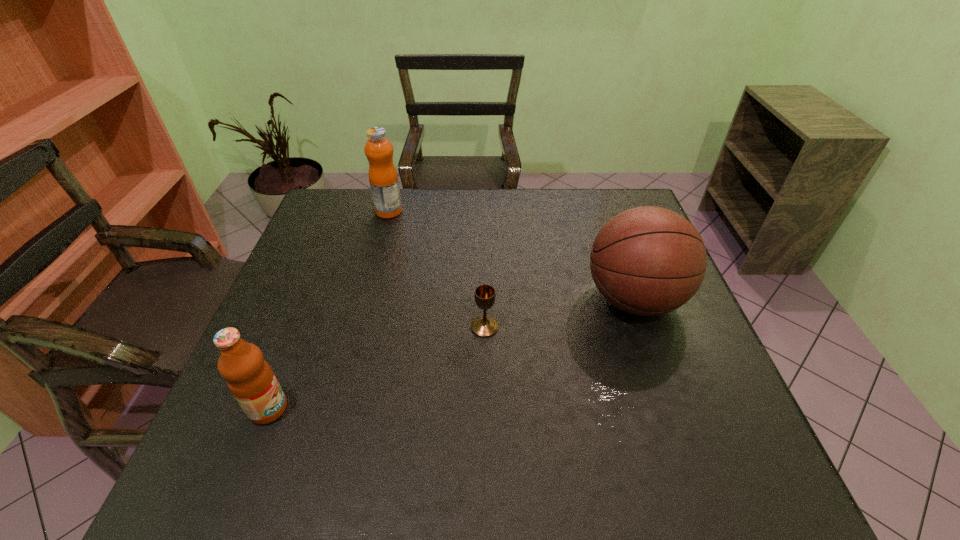
This screenshot has width=960, height=540. Find the location of `the farther fruit juice`. the farther fruit juice is located at coordinates (383, 178).

This screenshot has width=960, height=540. Identify the location of the third object from right to left. (383, 178).

Locate an element on the screen. the rightmost object is located at coordinates (648, 260).

Locate an element on the screen. The image size is (960, 540). the shorter fruit juice is located at coordinates (249, 377).

Identify the location of the left fruit juice. (249, 377).

I want to click on the shortest object, so click(x=485, y=295).

Find the location of a particular element. the second object from right to left is located at coordinates (485, 295).

Identify the location of free space located on the front of the second object from left to right. The width and height of the screenshot is (960, 540). (380, 245).

At what (x,y) coordinates should I click in order to perform the action: click on vacant space situated 0.150m on the left of the basketball. Please return your answer as a coordinate pair (x, y). The height and width of the screenshot is (540, 960). Looking at the image, I should click on (525, 299).

This screenshot has height=540, width=960. Identify the location of vacant area located on the front label of the shorter fruit juice. click(350, 409).